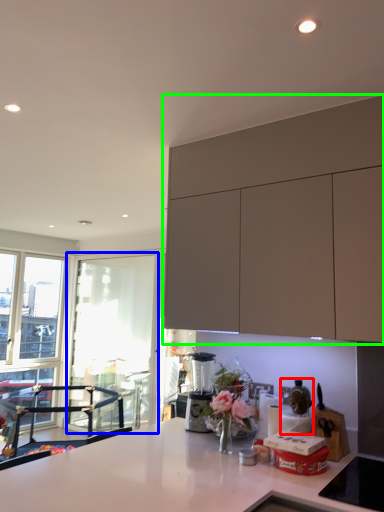
Question: Based on their relative distances, which object is farther from appliance (highlighted by a red box)? Choose from window screen (highlighted by a blue box) and cabinetry (highlighted by a green box).

Choices:
 (A) window screen
 (B) cabinetry

Answer: (A)